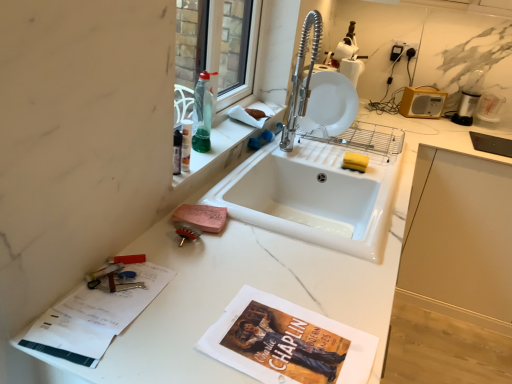
What is the approximate width of white plastic radio at upper right?

white plastic radio at upper right is 1.79 inches in width.

This screenshot has height=384, width=512. I want to click on white plastic radio at upper right, so click(422, 102).

Is translucent green liquid at sink left oriented towards white marble countertop at center?

No, translucent green liquid at sink left is not turned towards white marble countertop at center.

Identify the location of countertop below the translucent green liquid at sink left (from the image's perspective). This screenshot has width=512, height=384. (252, 285).

Based on their sizes in the image, would you say translucent green liquid at sink left is bigger or smaller than white marble countertop at center?

In the image, translucent green liquid at sink left appears to be smaller than white marble countertop at center.

Does white marble countertop at center have a smaller size compared to white glossy plate at upper center?

No.

Between point (141, 362) and point (341, 108), which one is positioned in front?

Positioned in front is point (141, 362).

Looking at this image, from a real-world perspective, which object rests below the other?

white marble countertop at center.

The width and height of the screenshot is (512, 384). In order to click on countertop to the left of white glossy plate at upper center in this screenshot , I will do `click(252, 285)`.

Considering the relative sizes of white glossy plate at upper center and white plastic radio at upper right in the image provided, is white glossy plate at upper center thinner than white plastic radio at upper right?

Yes, white glossy plate at upper center is thinner than white plastic radio at upper right.

Considering the relative positions of white glossy plate at upper center and white plastic radio at upper right in the image provided, is white glossy plate at upper center to the right of white plastic radio at upper right from the viewer's perspective?

In fact, white glossy plate at upper center is to the left of white plastic radio at upper right.

Is white glossy plate at upper center further to the viewer compared to white plastic radio at upper right?

No, it is not.

Is white glossy plate at upper center smaller than white plastic radio at upper right?

No.

Can you confirm if white plastic radio at upper right is thinner than translucent green liquid at sink left?

Yes, white plastic radio at upper right is thinner than translucent green liquid at sink left.

Measure the distance from white plastic radio at upper right to translucent green liquid at sink left.

white plastic radio at upper right is 1.24 meters from translucent green liquid at sink left.

Considering the positions of objects white plastic radio at upper right and translucent green liquid at sink left in the image provided, who is behind, white plastic radio at upper right or translucent green liquid at sink left?

Positioned behind is white plastic radio at upper right.

Who is shorter, white plastic radio at upper right or translucent green liquid at sink left?

With less height is white plastic radio at upper right.

From the picture: Does translucent green liquid at sink left appear on the right side of white plastic radio at upper right?

Incorrect, translucent green liquid at sink left is not on the right side of white plastic radio at upper right.

Based on their sizes in the image, would you say translucent green liquid at sink left is bigger or smaller than white plastic radio at upper right?

Considering their sizes, translucent green liquid at sink left takes up less space than white plastic radio at upper right.

Considering the relative sizes of translucent green liquid at sink left and white plastic radio at upper right in the image provided, is translucent green liquid at sink left shorter than white plastic radio at upper right?

Incorrect, the height of translucent green liquid at sink left does not fall short of that of white plastic radio at upper right.

Is white marble countertop at center facing away from transparent glass window at upper center?

No, transparent glass window at upper center is not at the back of white marble countertop at center.

How much distance is there between white marble countertop at center and transparent glass window at upper center?

white marble countertop at center and transparent glass window at upper center are 21.89 inches apart from each other.

Looking at this image, from the image's perspective, relative to transparent glass window at upper center, is white marble countertop at center above or below?

white marble countertop at center is situated lower than transparent glass window at upper center in the image.

Is white marble countertop at center thinner than transparent glass window at upper center?

In fact, white marble countertop at center might be wider than transparent glass window at upper center.

Consider the image. From the image's perspective, which one is positioned lower, translucent green liquid at sink left or white glossy plate at upper center?

From the image's view, translucent green liquid at sink left is below.

What's the angular difference between translucent green liquid at sink left and white glossy plate at upper center's facing directions?

They differ by 89.4 degrees in their facing directions.

Between translucent green liquid at sink left and white glossy plate at upper center, which one has less height?

translucent green liquid at sink left.

Are translucent green liquid at sink left and white glossy plate at upper center far apart?

translucent green liquid at sink left is actually quite close to white glossy plate at upper center.

At what (x,y) coordinates should I click in order to perform the action: click on countertop beneath the translucent green liquid at sink left (from a real-world perspective). Please return your answer as a coordinate pair (x, y). Looking at the image, I should click on (252, 285).

Where is `plate behind the white marble countertop at center`? This screenshot has height=384, width=512. plate behind the white marble countertop at center is located at coordinates (329, 105).

Considering their positions, is white marble countertop at center positioned closer to white glossy plate at upper center than white plastic radio at upper right?

Based on the image, white marble countertop at center appears to be nearer to white glossy plate at upper center.

Looking at the image, which one is located closer to translucent green liquid at sink left, transparent glass window at upper center or white marble countertop at center?

Based on the image, transparent glass window at upper center appears to be nearer to translucent green liquid at sink left.

From the image, which object appears to be nearer to white marble countertop at center, white glossy plate at upper center or translucent green liquid at sink left?

translucent green liquid at sink left is positioned closer to the anchor white marble countertop at center.

Based on their spatial positions, is white glossy plate at upper center or transparent glass window at upper center further from white marble countertop at center?

The object further to white marble countertop at center is white glossy plate at upper center.

Looking at this image, which object lies further to the anchor point white glossy plate at upper center, transparent glass window at upper center or white plastic radio at upper right?

Among the two, white plastic radio at upper right is located further to white glossy plate at upper center.

Estimate the real-world distances between objects in this image. Which object is further from white plastic radio at upper right, white marble countertop at center or translucent green liquid at sink left?

white marble countertop at center is positioned further to the anchor white plastic radio at upper right.

Estimate the real-world distances between objects in this image. Which object is closer to transparent glass window at upper center, white marble countertop at center or white glossy plate at upper center?

Based on the image, white glossy plate at upper center appears to be nearer to transparent glass window at upper center.

Which object lies nearer to the anchor point translucent green liquid at sink left, white glossy plate at upper center or white marble countertop at center?

Based on the image, white marble countertop at center appears to be nearer to translucent green liquid at sink left.

Locate an element on the screen. bottle located between transparent glass window at upper center and white glossy plate at upper center in the depth direction is located at coordinates (202, 113).

I want to click on plate positioned between transparent glass window at upper center and white plastic radio at upper right from near to far, so click(x=329, y=105).

Where is `window between translucent green liquid at sink left and white plastic radio at upper right from left to right`? window between translucent green liquid at sink left and white plastic radio at upper right from left to right is located at coordinates (228, 76).

This screenshot has width=512, height=384. In order to click on plate between white marble countertop at center and white plastic radio at upper right in the front-back direction in this screenshot , I will do `click(329, 105)`.